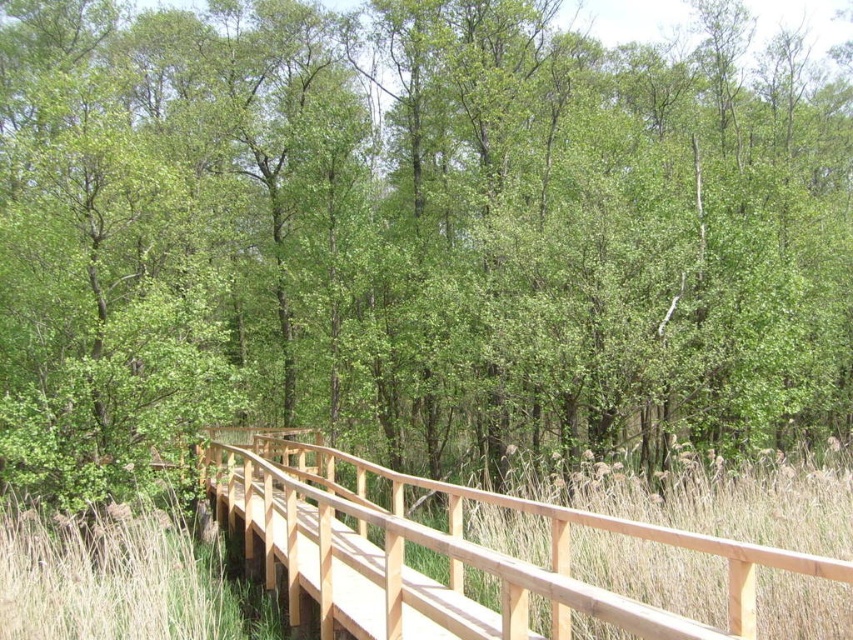
Question: Which of the following is the closest to the observer?

Choices:
 (A) (236, 637)
 (B) (367, 522)

Answer: (B)

Question: Does natural wood bridge at center have a greater width compared to golden reeds at center?

Choices:
 (A) yes
 (B) no

Answer: (A)

Question: Is natural wood bridge at center to the left of golden reeds at center from the viewer's perspective?

Choices:
 (A) yes
 (B) no

Answer: (B)

Question: Is natural wood bridge at center below golden reeds at center?

Choices:
 (A) yes
 (B) no

Answer: (A)

Question: Which of the following is the farthest from the observer?

Choices:
 (A) (157, 564)
 (B) (305, 557)

Answer: (B)